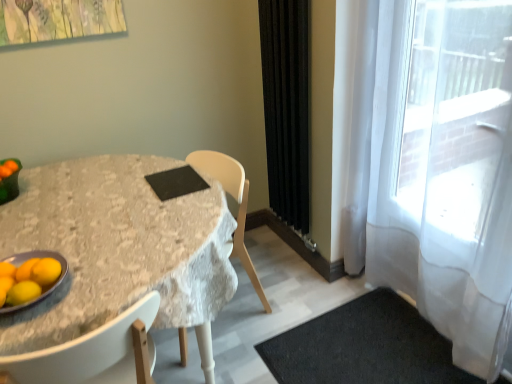
Question: Relative to yellow matte lemon at lower left, is orange matte tangerine at lower left in front or behind?

Choices:
 (A) front
 (B) behind

Answer: (B)

Question: Looking at the image, does orange matte tangerine at lower left seem bigger or smaller compared to yellow matte lemon at lower left?

Choices:
 (A) big
 (B) small

Answer: (A)

Question: Which is farther from the black fabric curtain at right, which is the 1th curtain in left-to-right order?

Choices:
 (A) linen-covered table at center
 (B) black rubber doormat at lower right
 (C) metallic gray platter at lower left
 (D) yellow matte/orange at lower left
 (E) white sheer curtain at right, the first curtain viewed from the right

Answer: (D)

Question: Estimate the real-world distances between objects in this image. Which object is farther from the yellow matte lemon at lower left?

Choices:
 (A) metallic gray platter at lower left
 (B) white sheer curtain at right, the 2th curtain positioned from the left
 (C) orange matte tangerine at lower left
 (D) black fabric curtain at right, which is the 1th curtain in left-to-right order
 (E) linen-covered table at center

Answer: (B)